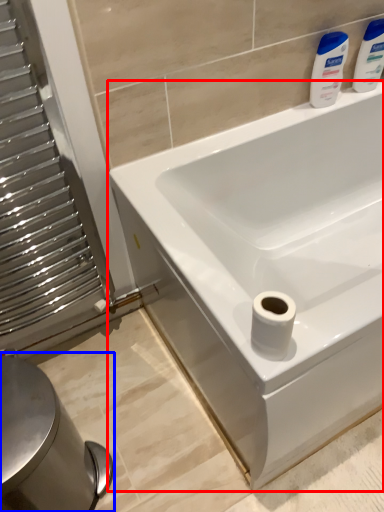
Question: Which point is further to the camera, bathtub (highlighted by a red box) or bidet (highlighted by a blue box)?

Choices:
 (A) bathtub
 (B) bidet

Answer: (B)